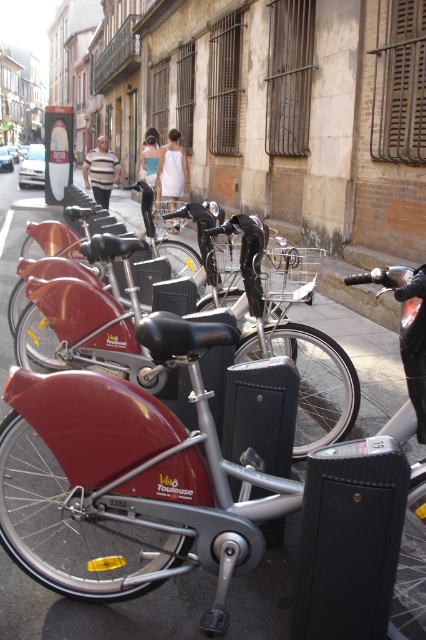
Question: Is matte red bicycle at center smaller than shiny metallic bicycle at center?

Choices:
 (A) yes
 (B) no

Answer: (A)

Question: Among these points, which one is nearest to the camera?

Choices:
 (A) (36, 237)
 (B) (322, 364)

Answer: (B)

Question: Is matte red bicycle at center to the right of shiny metallic bicycle at center from the viewer's perspective?

Choices:
 (A) yes
 (B) no

Answer: (A)

Question: Which point is closer to the camera?

Choices:
 (A) matte red bicycle at center
 (B) shiny metallic bicycle at center

Answer: (A)

Question: Does matte red bicycle at center appear on the right side of shiny metallic bicycle at center?

Choices:
 (A) yes
 (B) no

Answer: (A)

Question: Which of the following is the closest to the observer?

Choices:
 (A) shiny metallic bicycle at center
 (B) matte red bicycle at center

Answer: (B)